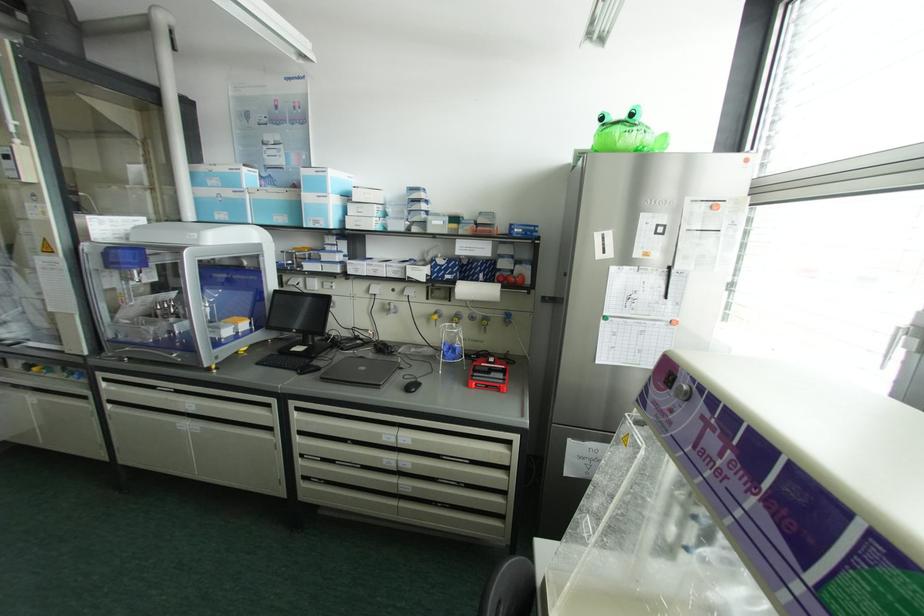
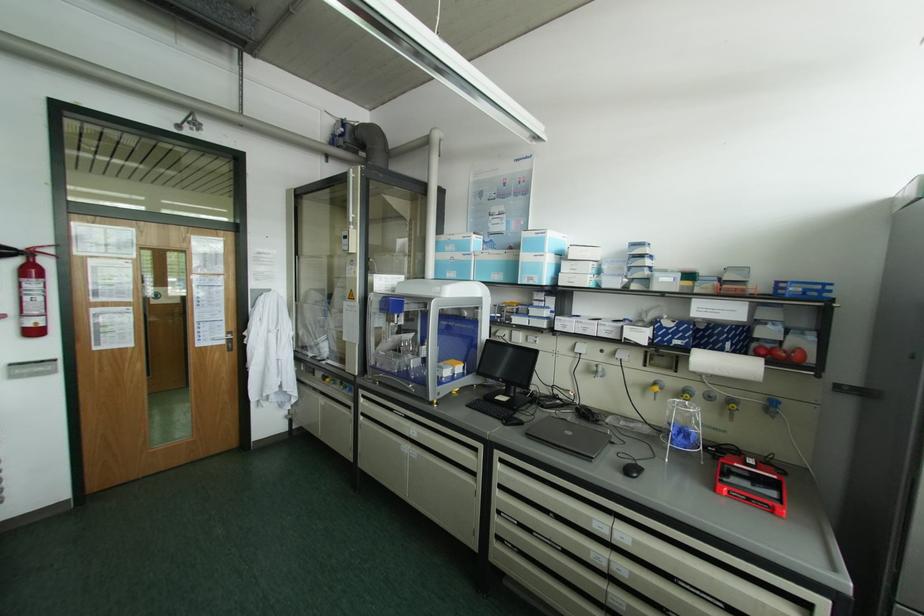
Find the pixel in the second image that matches point (434, 315) in the first image.

(655, 387)